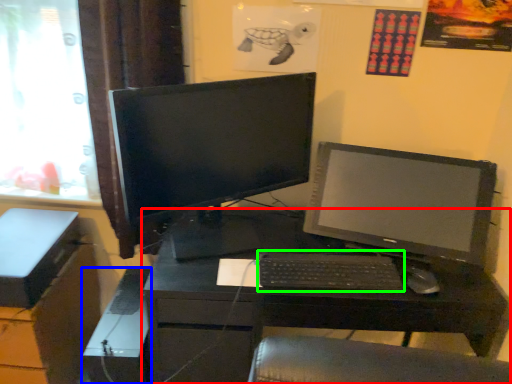
Question: Based on their relative distances, which object is farther from desk (highlighted by a red box)? Choose from computer tower (highlighted by a blue box) and computer keyboard (highlighted by a green box).

Choices:
 (A) computer tower
 (B) computer keyboard

Answer: (A)